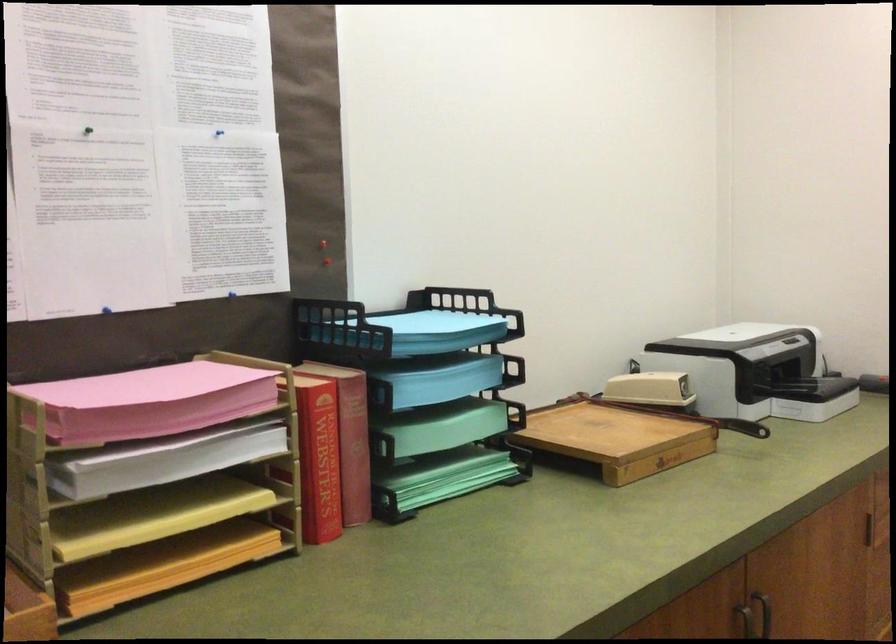
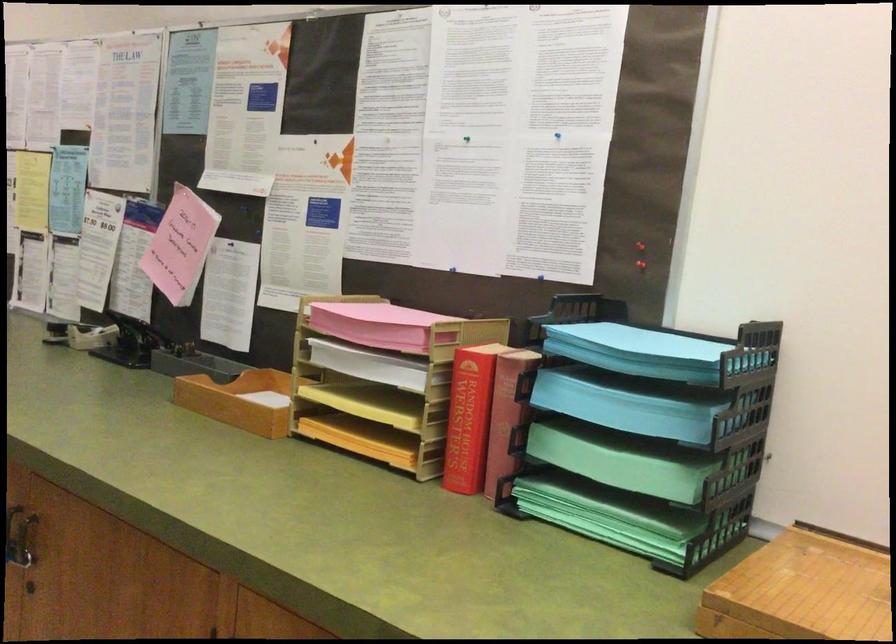
The point at [606,442] is marked in the first image. Where is the corresponding point in the second image?

(800, 591)